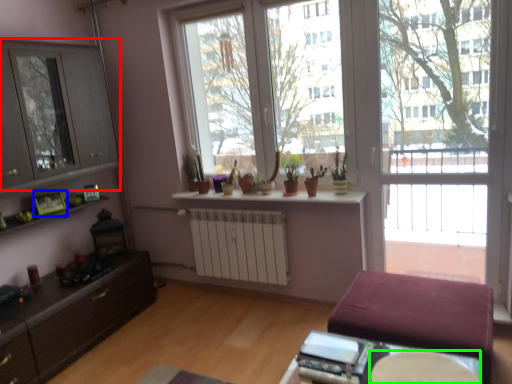
Question: Considering the real-world distances, which object is farthest from cabinet (highlighted by a red box)? picture frame (highlighted by a blue box) or round table (highlighted by a green box)?

Choices:
 (A) picture frame
 (B) round table

Answer: (B)